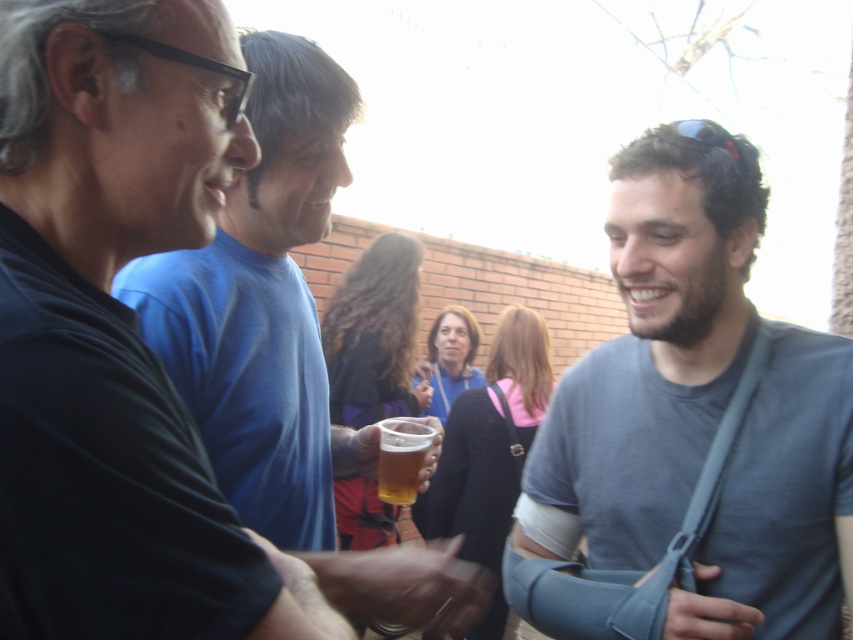
Can you confirm if blue smooth t-shirt at center is positioned to the right of translucent glass beer at center?

No, blue smooth t-shirt at center is not to the right of translucent glass beer at center.

Which is above, blue smooth t-shirt at center or translucent glass beer at center?

blue smooth t-shirt at center is above.

Where is `blue smooth t-shirt at center`? blue smooth t-shirt at center is located at coordinates (260, 301).

Image resolution: width=853 pixels, height=640 pixels. What are the coordinates of `blue smooth t-shirt at center` in the screenshot? It's located at (260, 301).

Does gray fabric arm sling at center come in front of translucent glass beer at center?

Yes, it is in front of translucent glass beer at center.

Is gray fabric arm sling at center shorter than translucent glass beer at center?

Incorrect, gray fabric arm sling at center's height does not fall short of translucent glass beer at center's.

Measure the distance between gray fabric arm sling at center and camera.

gray fabric arm sling at center is 4.06 feet from camera.

Identify the location of gray fabric arm sling at center. This screenshot has height=640, width=853. (651, 353).

Who is shorter, black matte t-shirt at left or translucent glass beer at center?

translucent glass beer at center is shorter.

Can you confirm if black matte t-shirt at left is positioned to the left of translucent glass beer at center?

Yes, black matte t-shirt at left is to the left of translucent glass beer at center.

Consider the image. Who is more forward, (91, 102) or (398, 452)?

Point (91, 102) is more forward.

This screenshot has height=640, width=853. I want to click on black matte t-shirt at left, so pyautogui.click(x=115, y=337).